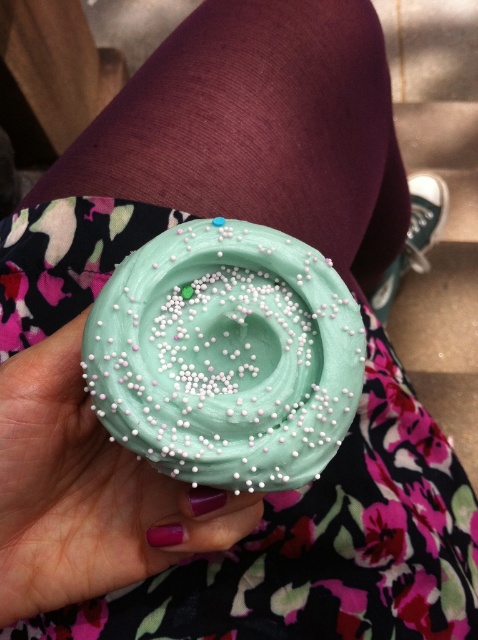
You are a baker arranging cupcakes on a display. You have two cupcakes at the center of the display, a teal frosting cupcake at center and a matte teal cupcake at center. Which one is placed to the right?

The teal frosting cupcake at center is positioned to the right of the matte teal cupcake at center, so the teal frosting cupcake at center is the one placed to the right.

You are a baker preparing to stack two cupcakes for a display. You have a teal frosting cupcake at center and a matte teal cupcake at center. Based on their positions in the image, which cupcake should you place on top to match the arrangement shown?

The teal frosting cupcake at center should be placed on top since it is positioned above the matte teal cupcake at center in the image.

You are a baker who needs to place two cupcakes on a 4 inch wide plate. Can both the teal frosting cupcake at center and the matte teal cupcake at center fit side by side on the plate?

The distance between the teal frosting cupcake at center and matte teal cupcake at center is 3.56 inches, which is less than the plate width of 4 inches. Therefore, both cupcakes can fit side by side on the plate.